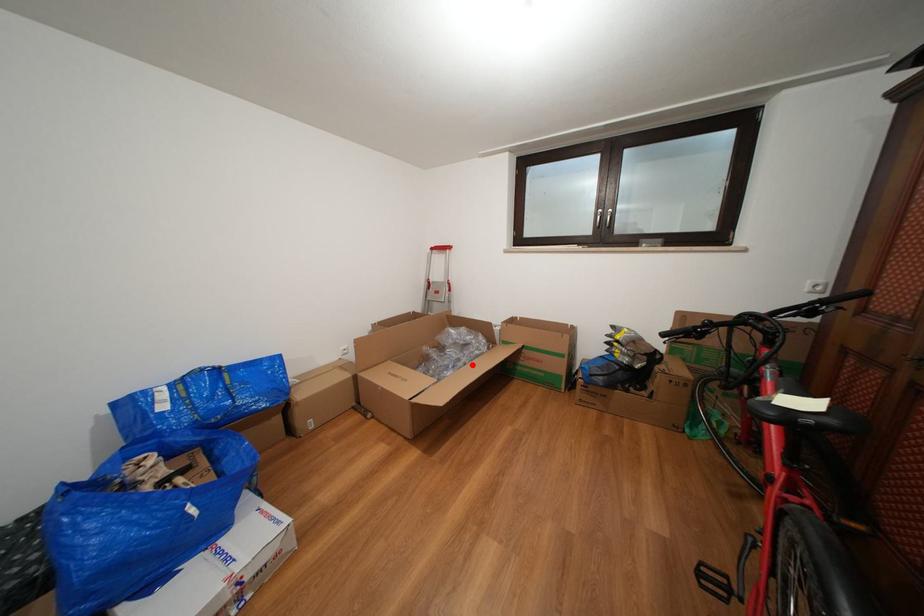
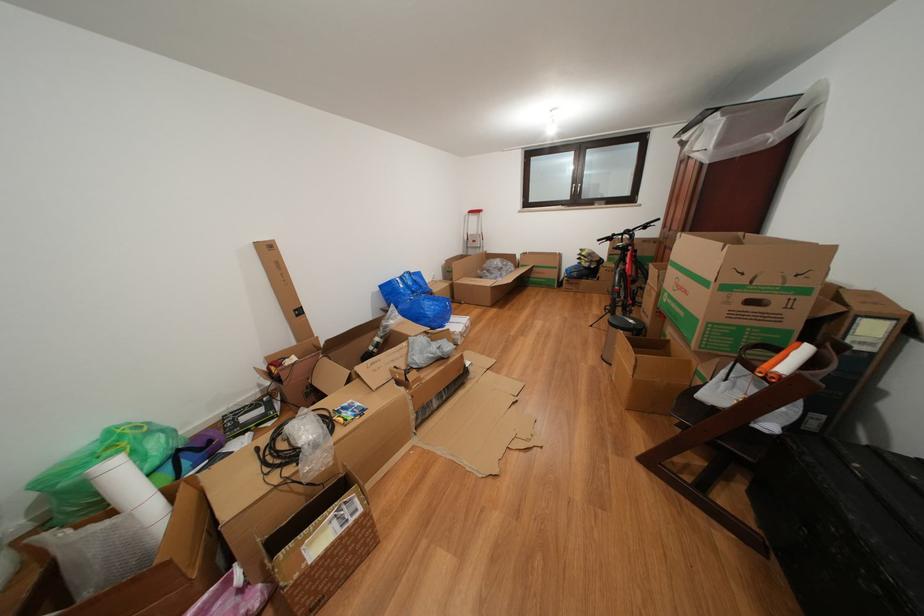
The point at the highlighted location is marked in the first image. Where is the corresponding point in the second image?

(513, 280)